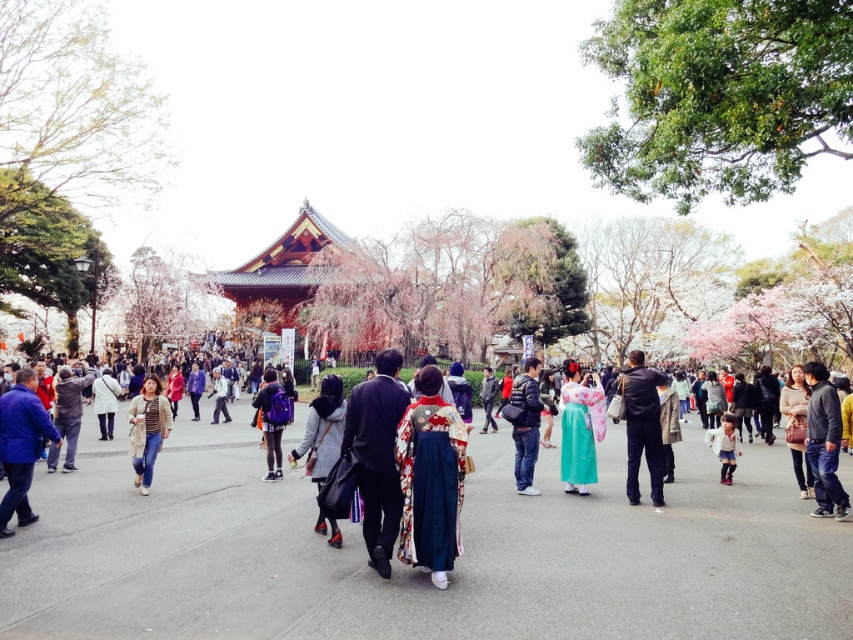
You are a photographer at the park and want to capture both the silky green kimono at center and the white cotton dress at center in a single photo. Which clothing item should you focus on first to ensure it appears larger in the photo?

The silky green kimono at center is much taller than the white cotton dress at center, so focusing on the silky green kimono at center first will ensure it appears larger in the photo.

You are standing at the origin point of the coordinate system in the image. You want to locate the silky green kimono at center. Which direction should you move to reach it?

The silky green kimono at center is located at coordinate point 0.672 on the x axis and 0.680 on the y axis. Since you are at the origin, you should move towards the northeast direction to reach it.